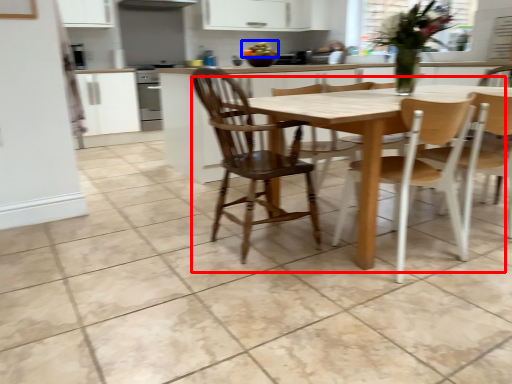
Question: Which object is closer to the camera taking this photo, kitchen & dining room table (highlighted by a red box) or food (highlighted by a blue box)?

Choices:
 (A) kitchen & dining room table
 (B) food

Answer: (A)